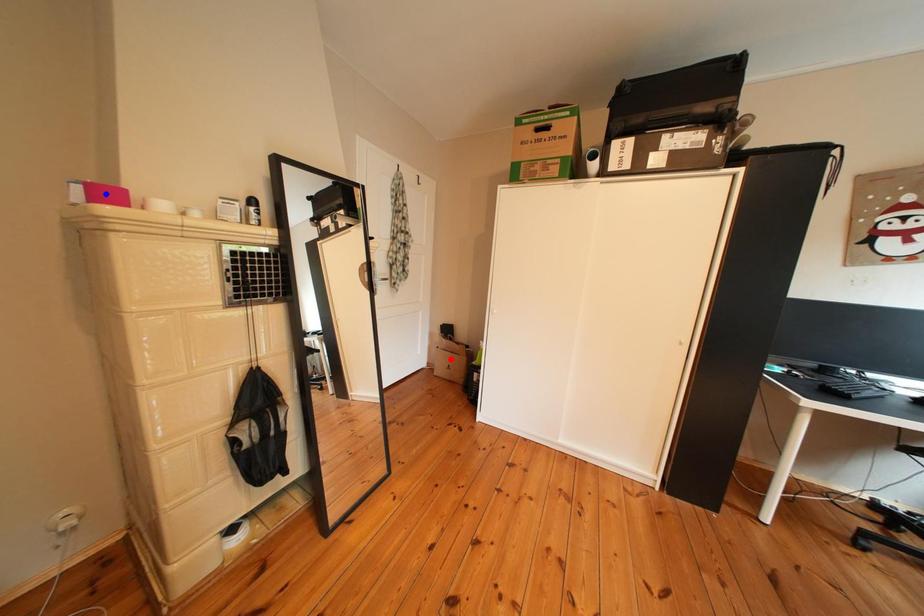
Question: Two points are marked on the image. Which point is closer to the camera?

Choices:
 (A) Blue point is closer.
 (B) Red point is closer.

Answer: (A)